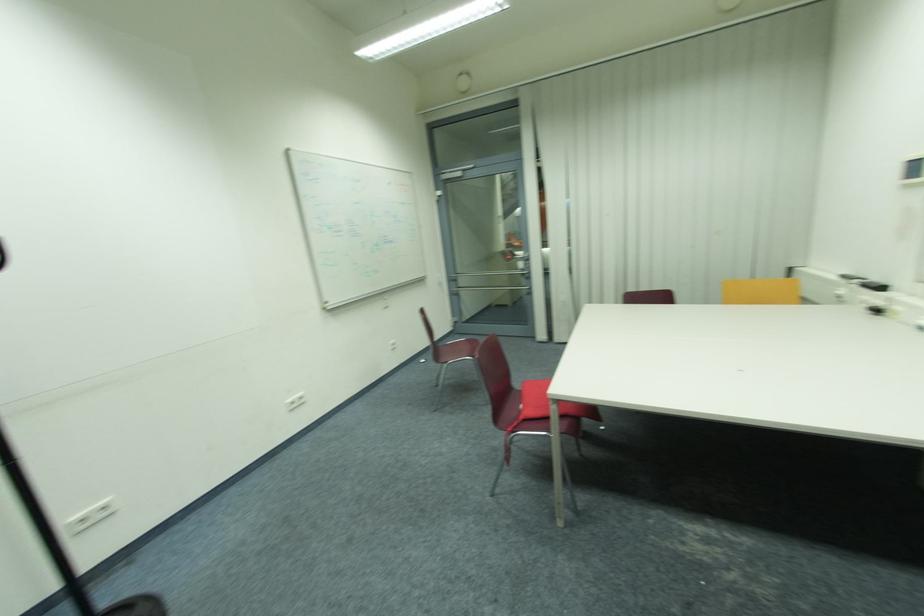
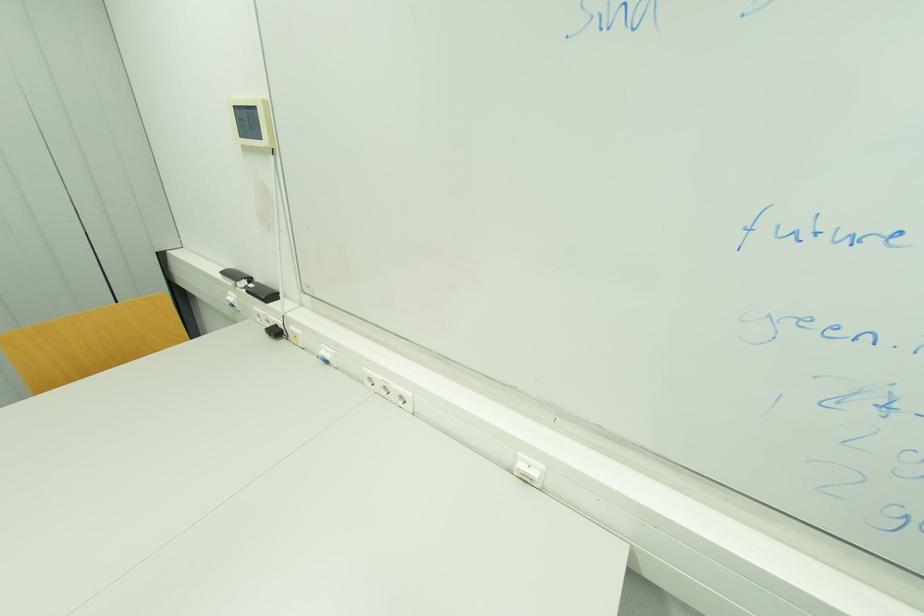
In the second image, find the point that corresponds to (882,313) in the first image.

(281, 333)